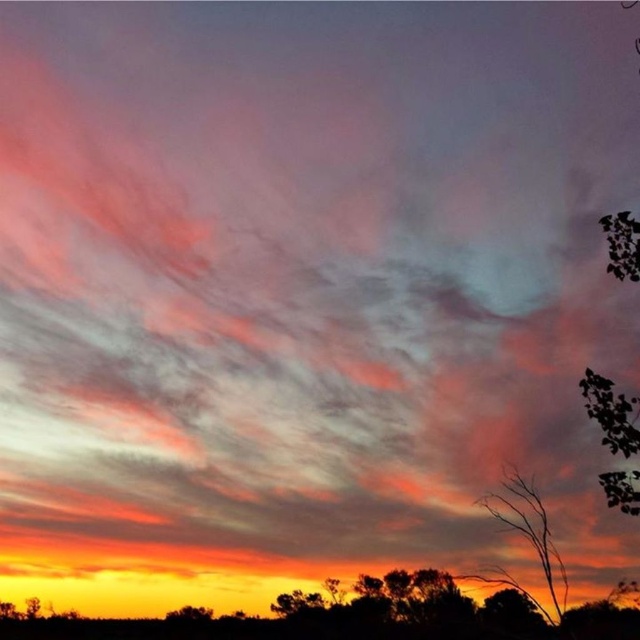
Question: Does green leafy tree at upper right appear on the left side of green leafy tree at lower center?

Choices:
 (A) no
 (B) yes

Answer: (A)

Question: Is silhouette bare tree at lower right to the left of green leafy tree at lower center from the viewer's perspective?

Choices:
 (A) yes
 (B) no

Answer: (B)

Question: Does green leafy tree at upper right appear over green leafy tree at lower center?

Choices:
 (A) no
 (B) yes

Answer: (B)

Question: Which object is positioned farthest from the green leafy tree at upper right?

Choices:
 (A) silhouette bare tree at lower right
 (B) green leafy tree at lower center

Answer: (B)

Question: Which of the following is the farthest from the observer?

Choices:
 (A) green leafy tree at upper right
 (B) silhouette bare tree at lower right

Answer: (B)

Question: Which of the following is the farthest from the observer?

Choices:
 (A) silhouette bare tree at lower right
 (B) green leafy tree at upper right

Answer: (A)